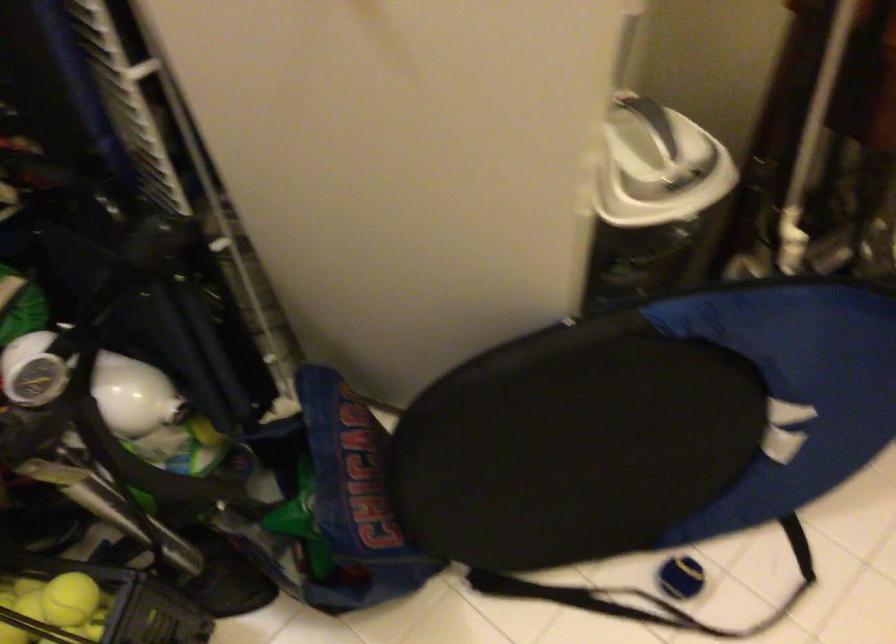
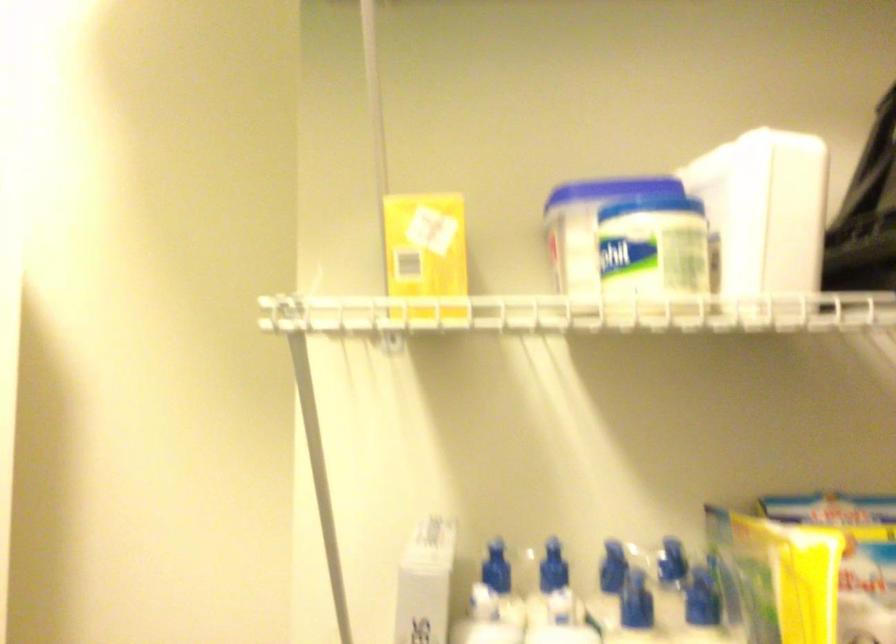
The images are taken continuously from a first-person perspective. In which direction is your viewpoint rotating?

The rotation direction of the camera is left-up.